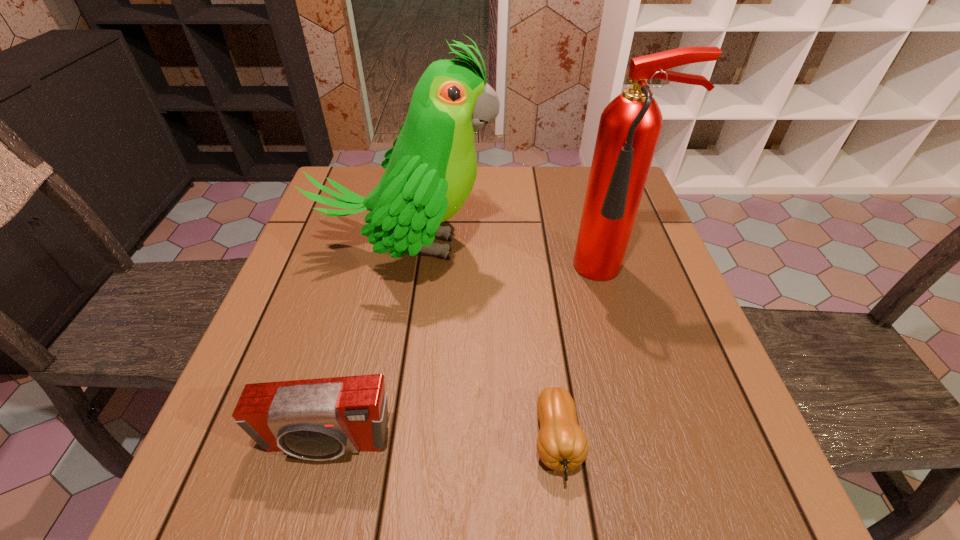
Image resolution: width=960 pixels, height=540 pixels. I want to click on parakeet located in the left edge section of the desktop, so click(430, 171).

Image resolution: width=960 pixels, height=540 pixels. What are the coordinates of `camera present at the left edge` in the screenshot? It's located at (321, 419).

Where is `object present at the right edge`? This screenshot has height=540, width=960. object present at the right edge is located at coordinates (630, 125).

At what (x,y) coordinates should I click in order to perform the action: click on object positioned at the far left corner. Please return your answer as a coordinate pair (x, y). The height and width of the screenshot is (540, 960). Looking at the image, I should click on (430, 171).

This screenshot has height=540, width=960. I want to click on object that is at the near left corner, so click(321, 419).

The image size is (960, 540). I want to click on vacant space at the far edge of the desktop, so tap(471, 201).

Identify the location of blank space at the near edge of the desktop. pyautogui.click(x=424, y=479).

Where is `vacant space at the left edge of the desktop`? vacant space at the left edge of the desktop is located at coordinates (210, 440).

Locate an element on the screen. The height and width of the screenshot is (540, 960). free space at the right edge of the desktop is located at coordinates tap(657, 320).

This screenshot has width=960, height=540. I want to click on vacant space at the near left corner of the desktop, so (x=224, y=491).